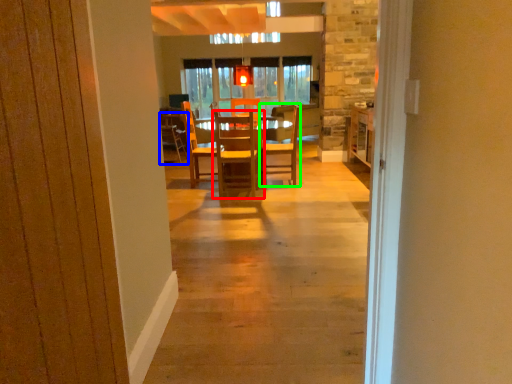
Question: Which is farther away from chair (highlighted by a red box)? chair (highlighted by a blue box) or chair (highlighted by a green box)?

Choices:
 (A) chair
 (B) chair

Answer: (A)